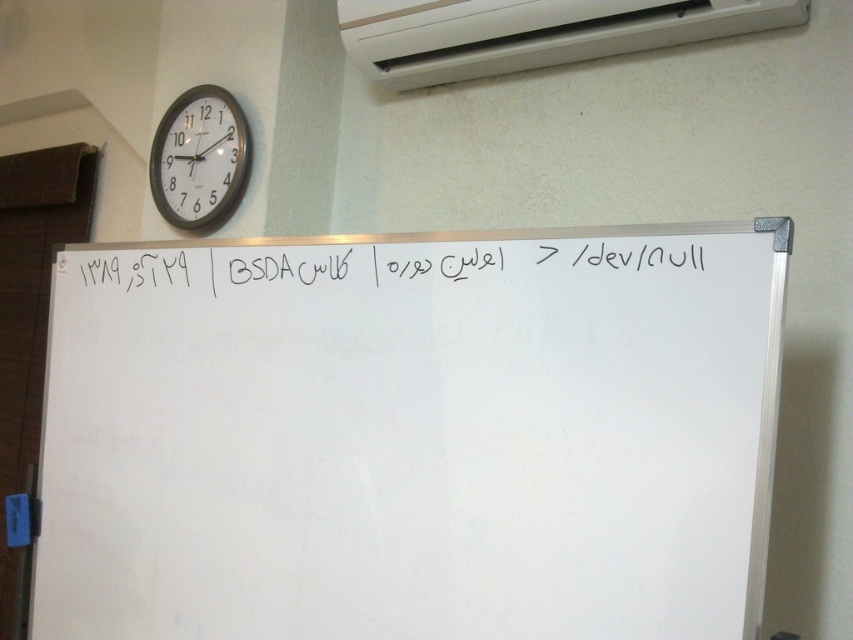
You are standing in a classroom and see the white matte whiteboard at center and the black chalk writing at center. Which object is closer to you?

The white matte whiteboard at center is closer to you because it is in front of the black chalk writing at center.

You are a student entering a classroom and see the white matte whiteboard at center and the black chalk writing at center. Which object is located higher on the wall?

The black chalk writing at center is located higher on the wall than the white matte whiteboard at center.